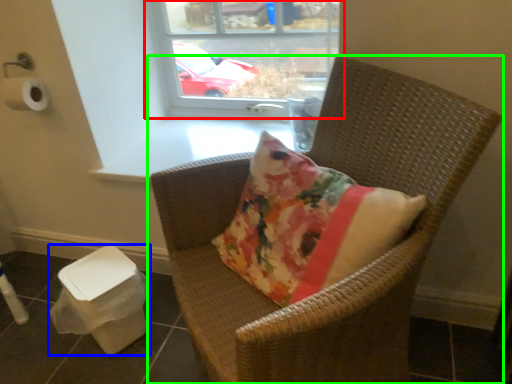
Question: Which is farther away from window (highlighted by a red box)? potty (highlighted by a blue box) or chair (highlighted by a green box)?

Choices:
 (A) potty
 (B) chair

Answer: (A)